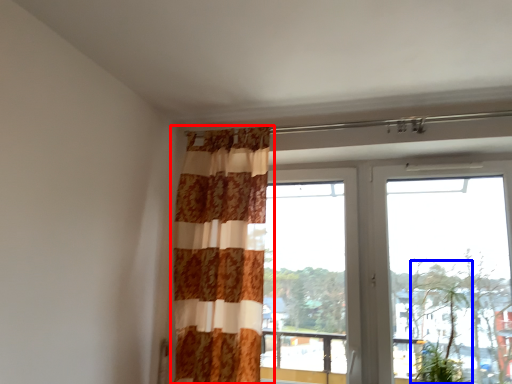
Question: Among these objects, which one is farthest to the camera, curtain (highlighted by a red box) or plant (highlighted by a blue box)?

Choices:
 (A) curtain
 (B) plant

Answer: (A)